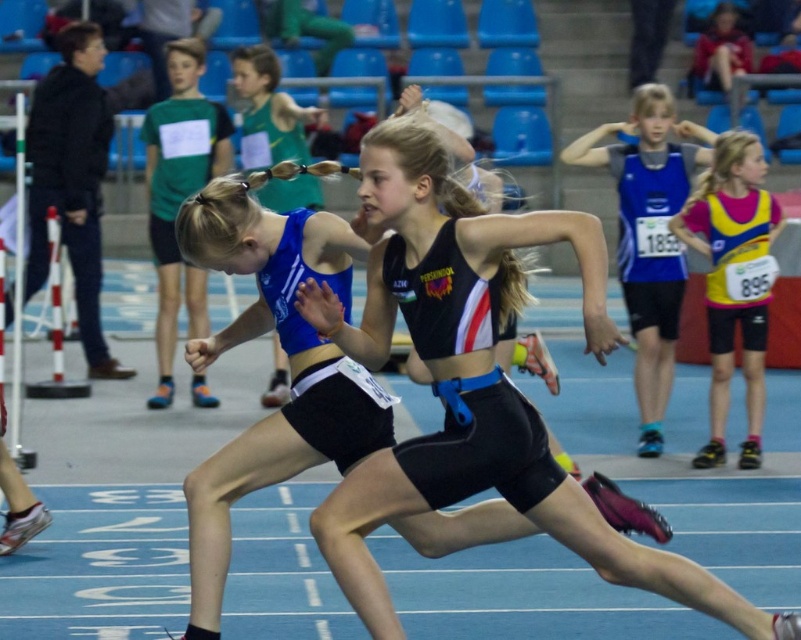
You are a photographer at a track event. You need to capture a photo of the athlete wearing the yellow and pink jersey at right and the athlete in matte black shorts at left. Which athlete should you focus on if you want to photograph the one with the smaller clothing size?

The yellow and pink jersey at right has a smaller size compared to the matte black shorts at left, so you should focus on the athlete wearing the yellow and pink jersey at right.